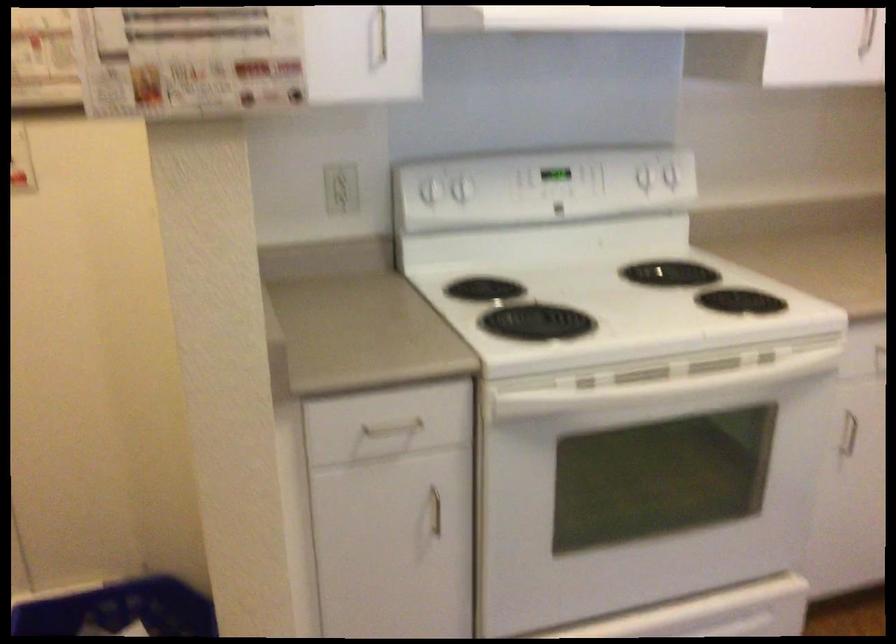
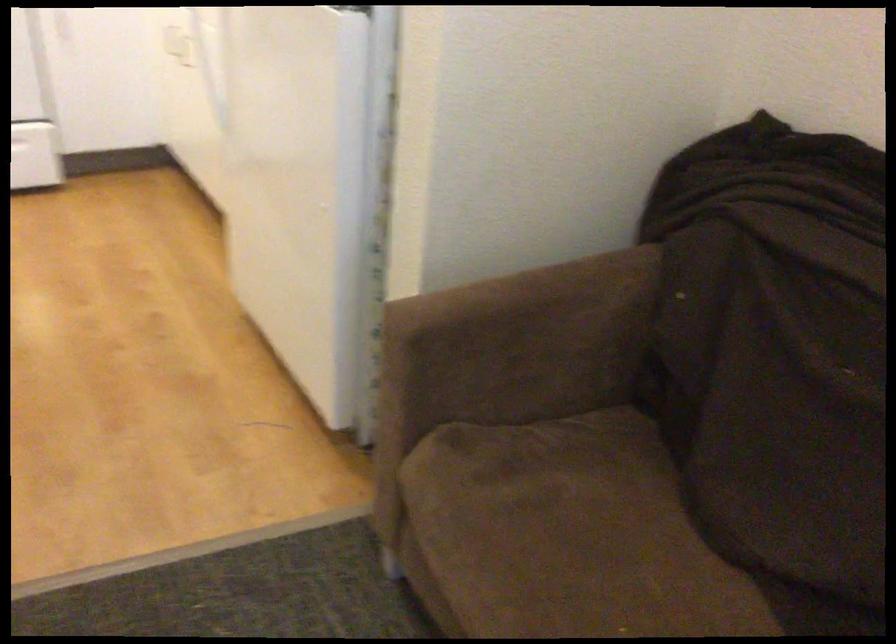
In a continuous first-person perspective shot, in which direction is the camera moving?

The cameraman moved toward right, backward.